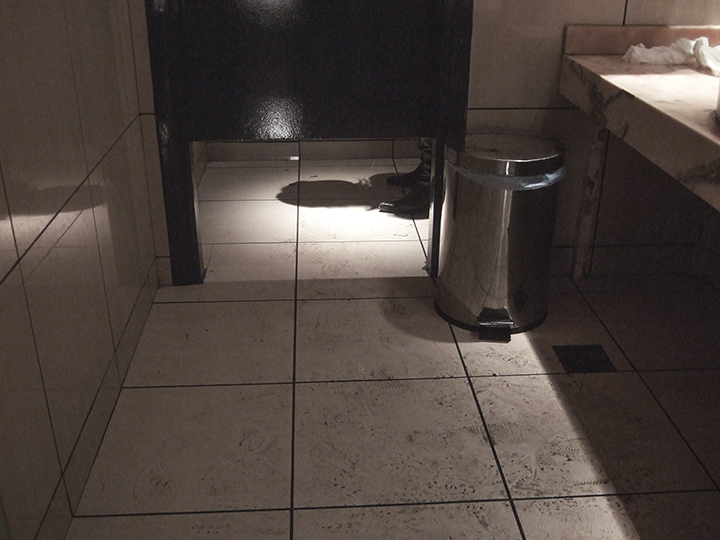
Locate an element on the screen. Image resolution: width=720 pixels, height=540 pixels. tile flooring is located at coordinates (391, 426).